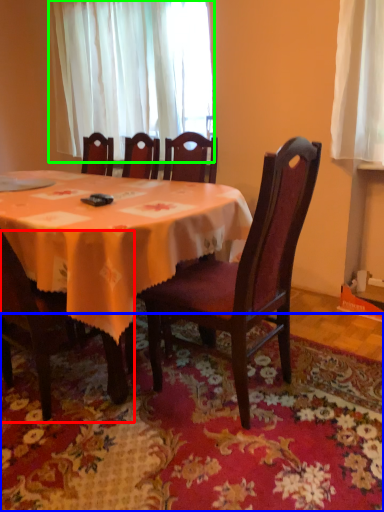
Question: Considering the real-world distances, which object is farthest from chair (highlighted by a red box)? mat (highlighted by a blue box) or curtain (highlighted by a green box)?

Choices:
 (A) mat
 (B) curtain

Answer: (B)